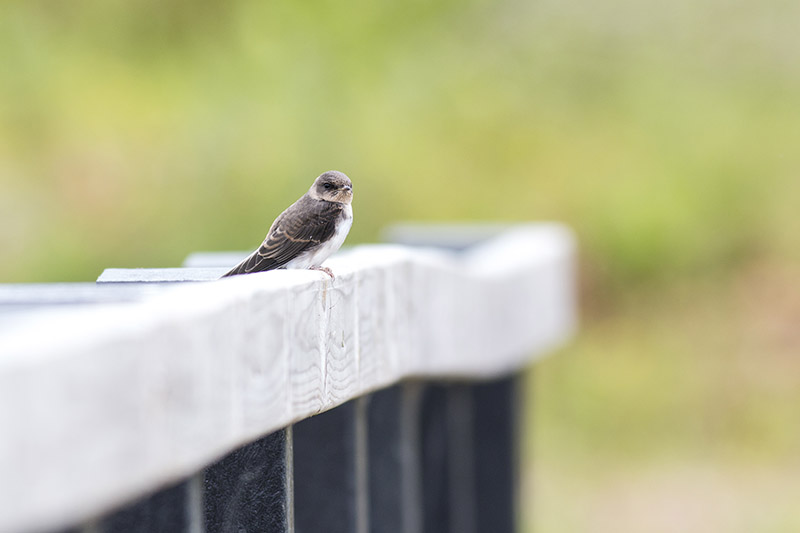
The width and height of the screenshot is (800, 533). In order to click on wooden beam in this screenshot , I will do `click(298, 337)`, `click(486, 300)`, `click(150, 383)`.